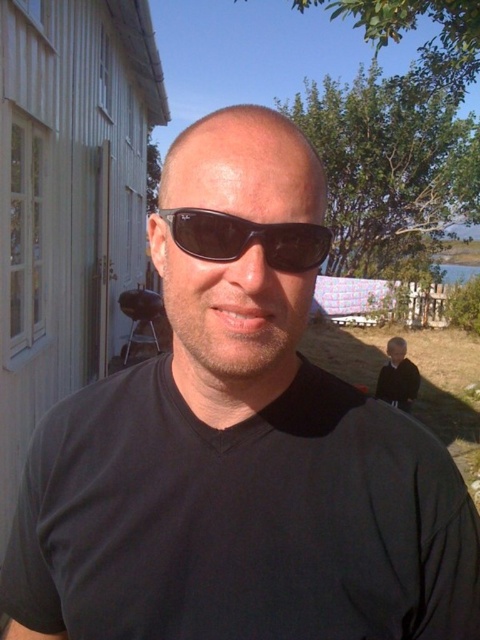
Question: Can you confirm if black plastic sunglasses at center is thinner than black fabric child at lower right?

Choices:
 (A) no
 (B) yes

Answer: (B)

Question: Which point is closer to the camera taking this photo?

Choices:
 (A) (414, 381)
 (B) (289, 268)

Answer: (B)

Question: Observing the image, what is the correct spatial positioning of black plastic sunglasses at center in reference to black fabric child at lower right?

Choices:
 (A) left
 (B) right

Answer: (A)

Question: Does black plastic sunglasses at center appear under black fabric child at lower right?

Choices:
 (A) no
 (B) yes

Answer: (A)

Question: Which point is closer to the camera?

Choices:
 (A) black fabric child at lower right
 (B) black plastic sunglasses at center

Answer: (B)